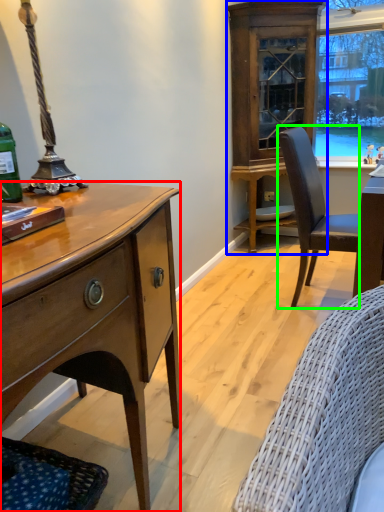
Question: Which is nearer to the desk (highlighted by a red box)? cabinetry (highlighted by a blue box) or chair (highlighted by a green box).

Choices:
 (A) cabinetry
 (B) chair

Answer: (B)